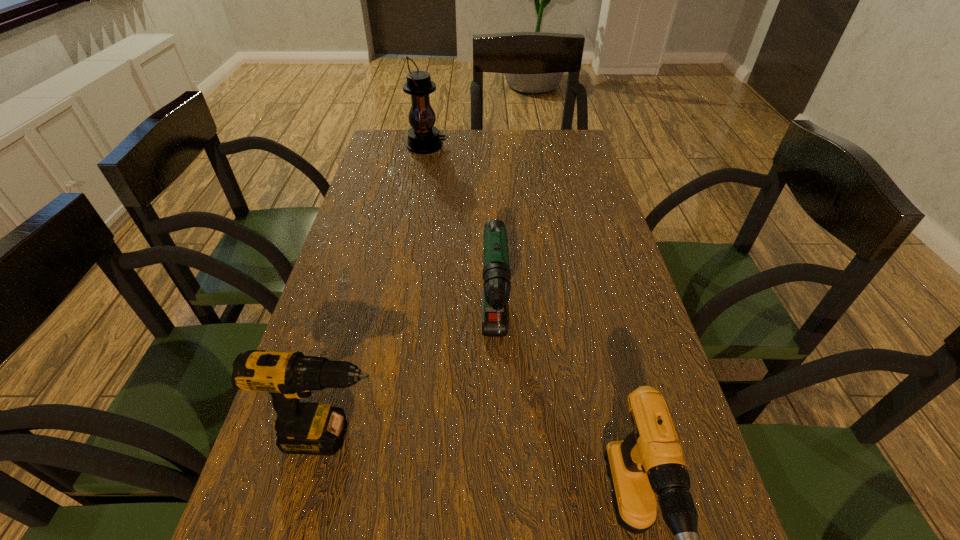
This screenshot has height=540, width=960. What are the coordinates of `drill present at the left edge` in the screenshot? It's located at (307, 428).

This screenshot has width=960, height=540. In order to click on object present at the far left corner in this screenshot , I will do `click(423, 138)`.

The height and width of the screenshot is (540, 960). Identify the location of vacant space at the far edge. (492, 150).

Locate an element on the screen. This screenshot has height=540, width=960. vacant space at the left edge of the desktop is located at coordinates (366, 423).

In the image, there is a desktop. Where is `vacant space at the right edge`? vacant space at the right edge is located at coordinates (598, 184).

Find the location of a particular element. The image size is (960, 540). free location at the far right corner of the desktop is located at coordinates (583, 154).

Find the location of a particular element. free space between the leftmost drill and the lantern is located at coordinates (379, 291).

The width and height of the screenshot is (960, 540). I want to click on free space between the third nearest object and the lantern, so click(461, 245).

Locate an element on the screen. The width and height of the screenshot is (960, 540). free space that is in between the leftmost drill and the second farthest object is located at coordinates (414, 390).

Locate an element on the screen. The height and width of the screenshot is (540, 960). object that can be found as the closest to the second drill from right to left is located at coordinates (307, 428).